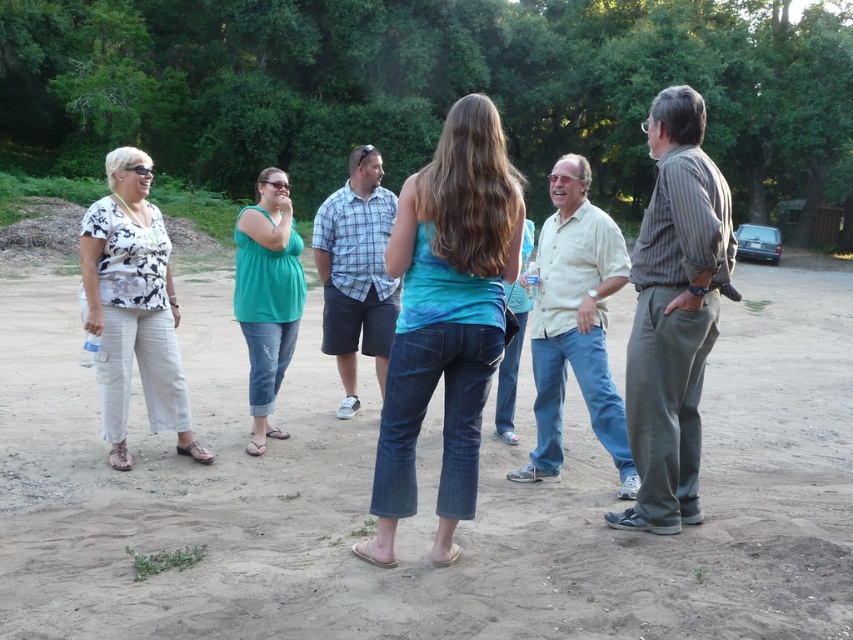
Based on the scene description, can you determine the spatial relationship between the white linen pants at left and the light blue plaid shirt at center? Specifically, which one is positioned to the left?

The white linen pants at left are positioned to the left of the light blue plaid shirt at center.

You are standing at the origin point of the image. There is a white linen pants at left located at point (x=132, y=307). Can you tell me the direction of the white linen pants at left relative to your current position?

The white linen pants at left is located to the left side of your current position at the origin point.